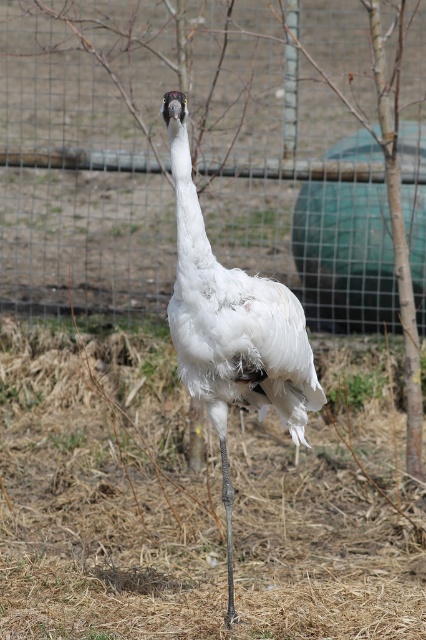
Question: Which point is farther from the camera taking this photo?

Choices:
 (A) (203, 10)
 (B) (409, 579)
 (C) (273, 387)

Answer: (A)

Question: Estimate the real-world distances between objects in this image. Which object is closer to the wire mesh fence at center?

Choices:
 (A) white fluffy hay at center
 (B) white feathered bird at center

Answer: (A)

Question: Among these objects, which one is nearest to the camera?

Choices:
 (A) wire mesh fence at center
 (B) white feathered bird at center
 (C) white fluffy hay at center

Answer: (B)

Question: Can you confirm if white fluffy hay at center is positioned to the right of wire mesh fence at center?

Choices:
 (A) no
 (B) yes

Answer: (A)

Question: Can you confirm if wire mesh fence at center is positioned to the left of white feathered bird at center?

Choices:
 (A) no
 (B) yes

Answer: (B)

Question: Is wire mesh fence at center to the right of white feathered bird at center from the viewer's perspective?

Choices:
 (A) yes
 (B) no

Answer: (B)